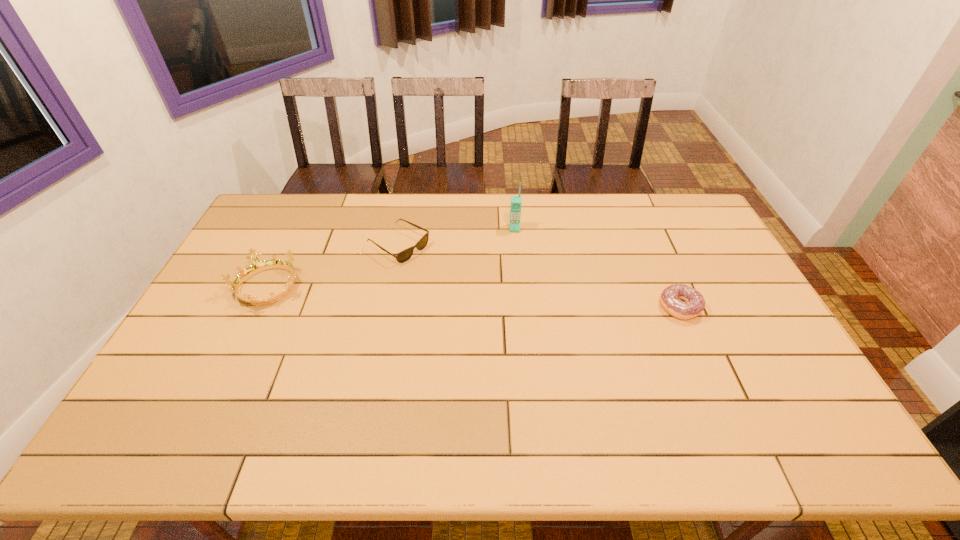
This screenshot has height=540, width=960. In order to click on vacant space on the desktop that is between the leftmost object and the doughnut and is positioned on the keypad of the cellular telephone in this screenshot , I will do `click(514, 299)`.

Locate an element on the screen. vacant space on the desktop that is between the crown and the rightmost object and is positioned on the lenses of the second object from left to right is located at coordinates (491, 298).